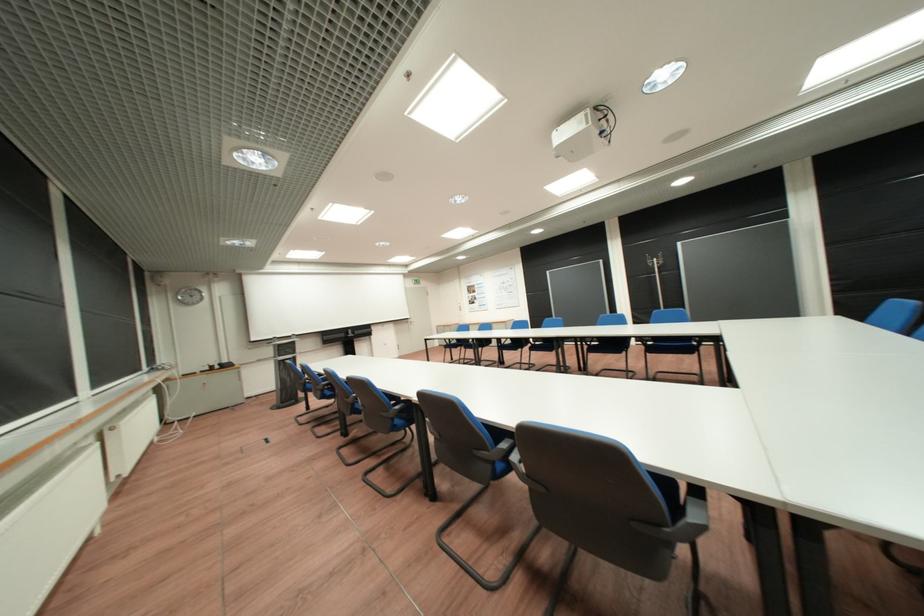
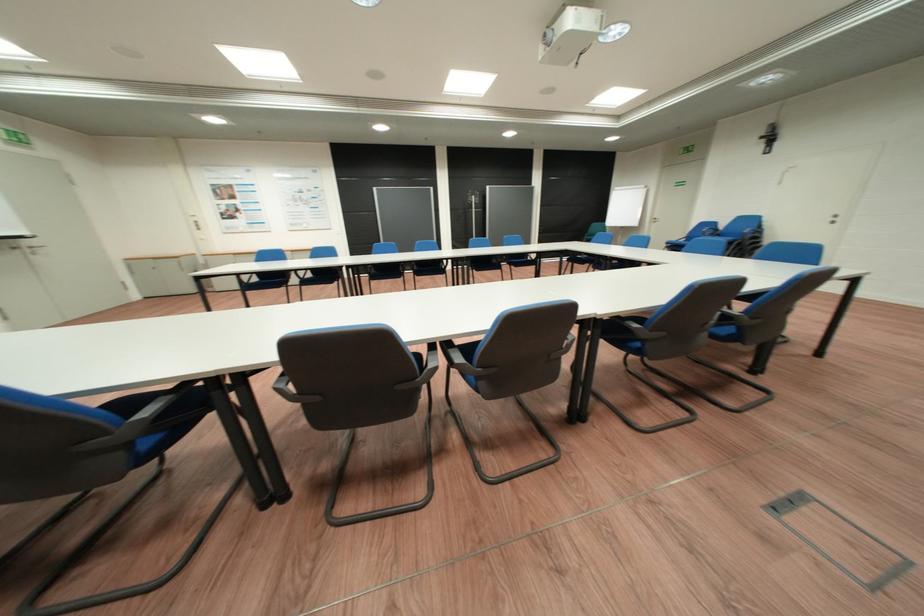
Where in the second image is the point corresponding to (651,317) from the first image?

(468, 246)